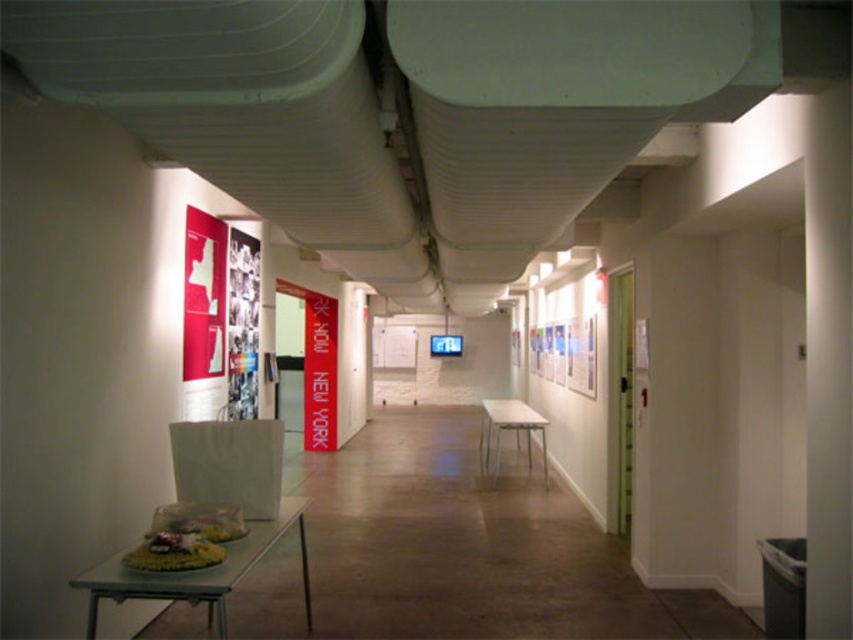
Question: Which object appears closest to the camera in this image?

Choices:
 (A) white glossy table at center
 (B) white plastic table at lower left

Answer: (B)

Question: In this image, where is white plastic table at lower left located relative to white glossy table at center?

Choices:
 (A) right
 (B) left

Answer: (B)

Question: Can you confirm if white plastic table at lower left is positioned to the right of white glossy table at center?

Choices:
 (A) no
 (B) yes

Answer: (A)

Question: Does white plastic table at lower left have a larger size compared to white glossy table at center?

Choices:
 (A) no
 (B) yes

Answer: (B)

Question: Which object appears farthest from the camera in this image?

Choices:
 (A) white plastic table at lower left
 (B) white glossy table at center

Answer: (B)